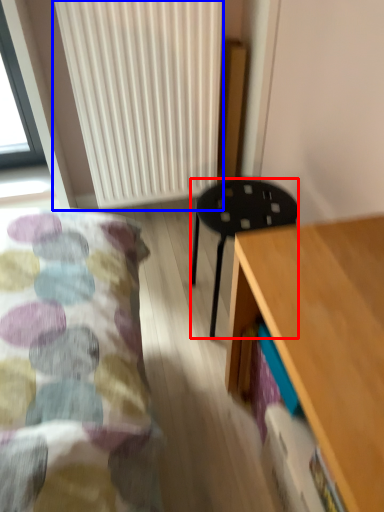
Question: Which point is closer to the camera, stool (highlighted by a red box) or radiator (highlighted by a blue box)?

Choices:
 (A) stool
 (B) radiator

Answer: (A)